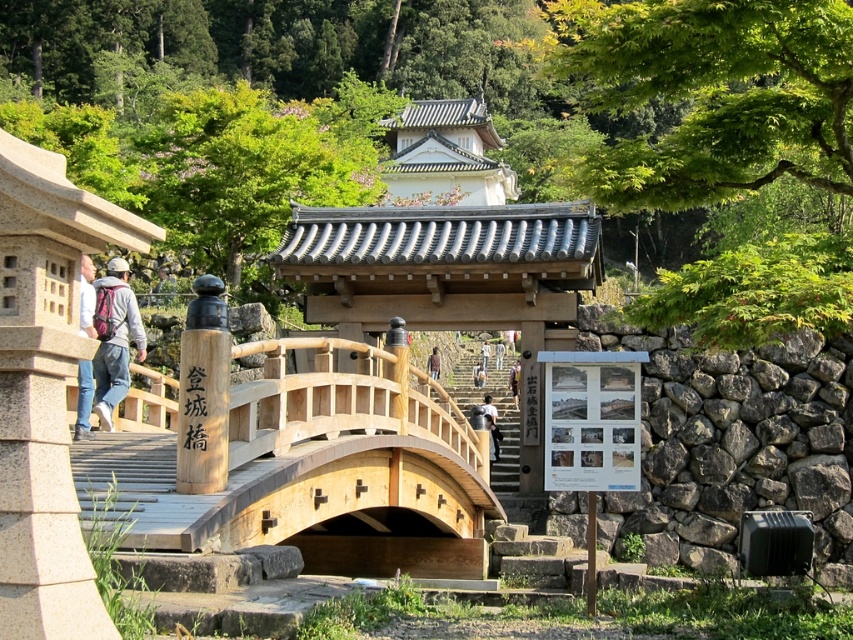
Question: Which of the following is the closest to the observer?

Choices:
 (A) natural wood bridge at center
 (B) brown wooden sign at center

Answer: (A)

Question: Which object is positioned farthest from the brown leather jacket at center?

Choices:
 (A) brown wooden sign at center
 (B) natural wood bridge at center

Answer: (B)

Question: Among these objects, which one is nearest to the camera?

Choices:
 (A) natural wood bridge at center
 (B) brown wooden sign at center

Answer: (A)

Question: Can you confirm if denim jacket at left is positioned to the left of light brown wooden signpost at center?

Choices:
 (A) yes
 (B) no

Answer: (A)

Question: Observing the image, what is the correct spatial positioning of denim jacket at left in reference to brown wooden sign at center?

Choices:
 (A) left
 (B) right

Answer: (A)

Question: Is light brown wooden signpost at center below white cotton shirt at center?

Choices:
 (A) yes
 (B) no

Answer: (B)